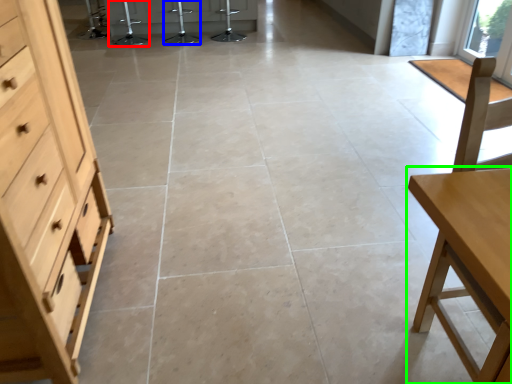
Question: Which object is the closest to the bar stool (highlighted by a red box)? Choose among these: bar stool (highlighted by a blue box) or table (highlighted by a green box).

Choices:
 (A) bar stool
 (B) table

Answer: (A)